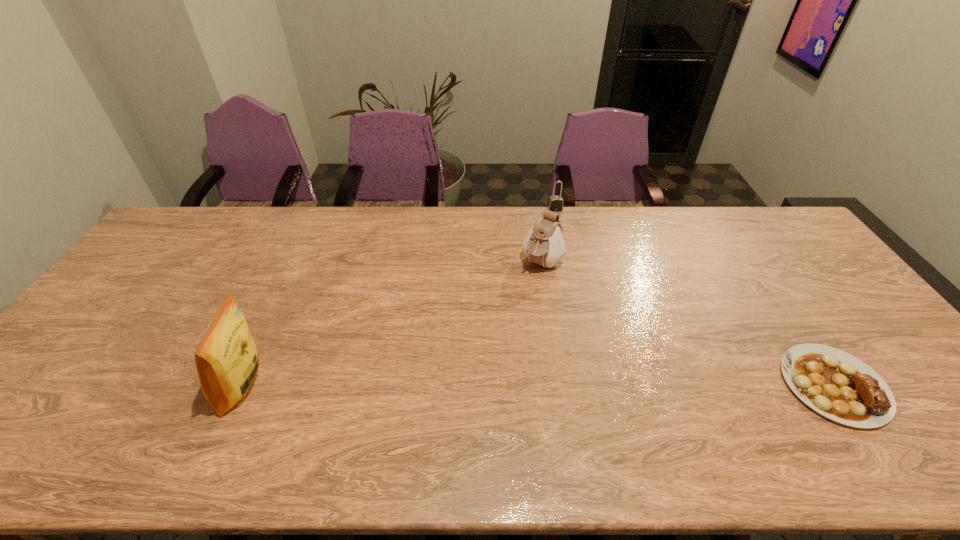
This screenshot has height=540, width=960. In order to click on vacant space on the desktop that is between the crisp (potato chip) and the rightmost object and is positioned on the front-facing side of the second farthest object in this screenshot , I will do `click(454, 386)`.

Locate an element on the screen. This screenshot has height=540, width=960. free space on the desktop that is between the tallest object and the rightmost object and is positioned on the shackle of the third tallest object is located at coordinates (616, 386).